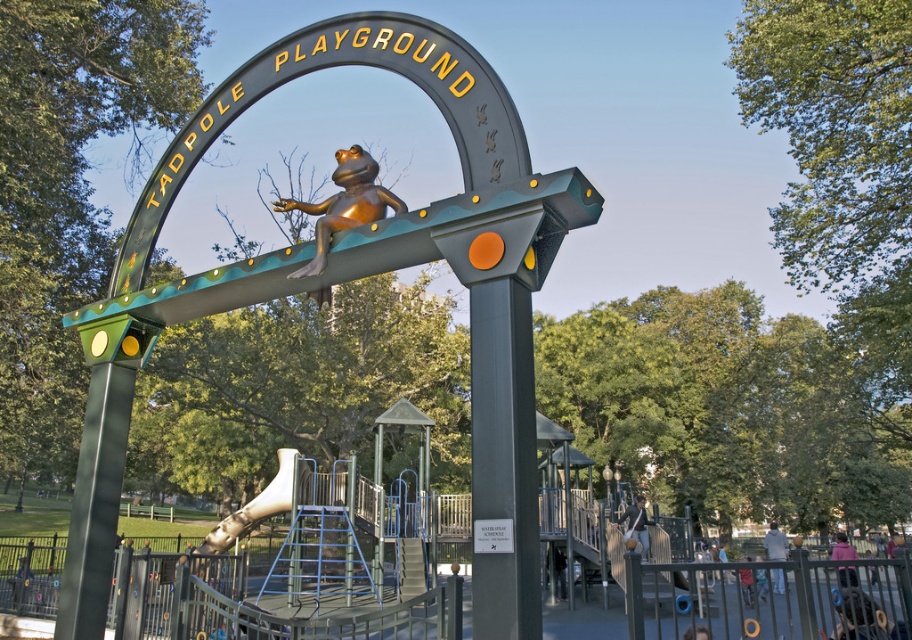
Question: From the image, what is the correct spatial relationship of bronze shiny frog at center in relation to metallic silver slide at center?

Choices:
 (A) below
 (B) above

Answer: (B)

Question: Is bronze shiny frog at center behind metallic silver slide at center?

Choices:
 (A) no
 (B) yes

Answer: (A)

Question: Can you confirm if bronze shiny frog at center is positioned to the right of metallic silver slide at center?

Choices:
 (A) yes
 (B) no

Answer: (A)

Question: Which object appears farthest from the camera in this image?

Choices:
 (A) metallic silver slide at center
 (B) bronze shiny frog at center

Answer: (A)